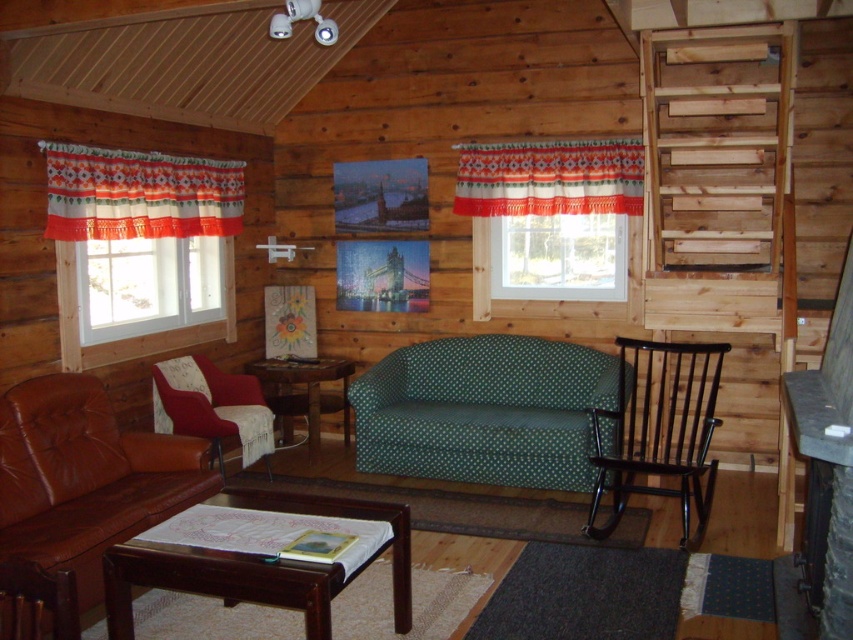
Question: Among these objects, which one is farthest from the camera?

Choices:
 (A) wooden side table at center
 (B) brown leather couch at lower left
 (C) brown wooden coffee table at center
 (D) black wood rocking chair at lower right

Answer: (A)

Question: Which object is closer to the camera taking this photo?

Choices:
 (A) black wood rocking chair at lower right
 (B) orange and white woven curtain at upper center
 (C) brown leather couch at lower left

Answer: (C)

Question: Which point is closer to the camera?

Choices:
 (A) velvet red armchair at lower left
 (B) wooden side table at center
 (C) brown leather couch at lower left

Answer: (C)

Question: Considering the relative positions of orange and white patterned curtain at left and transparent glass window at center in the image provided, where is orange and white patterned curtain at left located with respect to transparent glass window at center?

Choices:
 (A) left
 (B) right

Answer: (A)

Question: Does green dotted fabric couch at center come in front of brown wooden coffee table at center?

Choices:
 (A) no
 (B) yes

Answer: (A)

Question: Can you confirm if wooden stairs at upper right is positioned above brown leather couch at lower left?

Choices:
 (A) yes
 (B) no

Answer: (A)